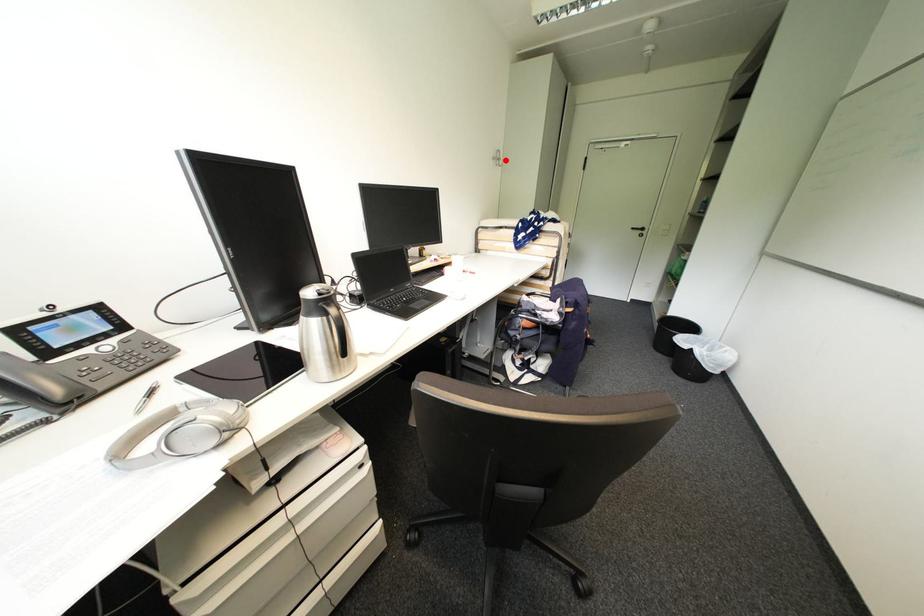
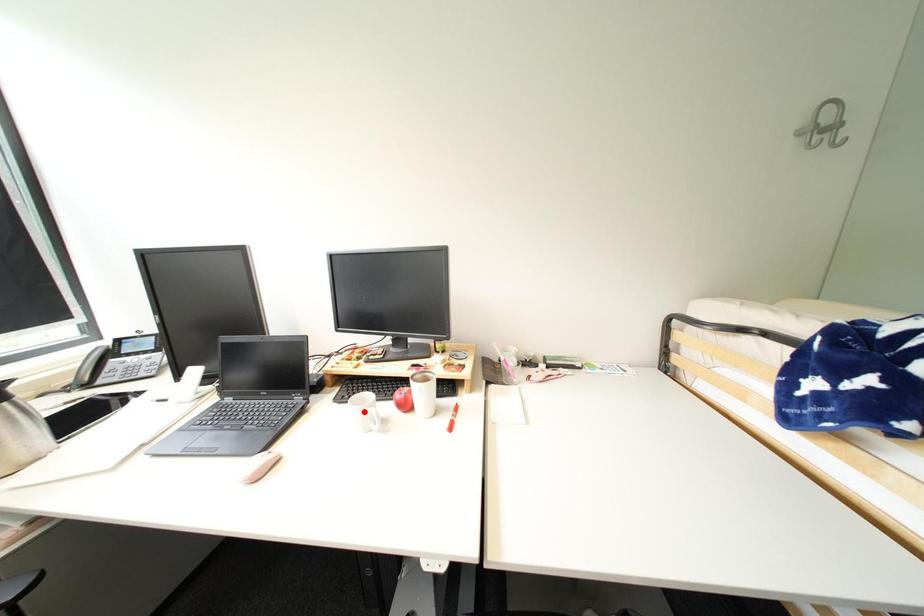
I am providing you with two images of the same scene from different viewpoints. A red point is marked on the first image and another point is marked on the second image. Do the highlighted points in image1 and image2 indicate the same real-world spot?

No